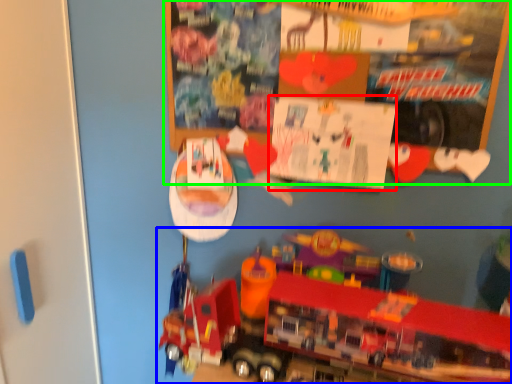
Question: Estimate the real-world distances between objects in this image. Which object is farther from poster page (highlighted by a red box), toy (highlighted by a blue box) or bulletin board (highlighted by a green box)?

Choices:
 (A) toy
 (B) bulletin board

Answer: (A)